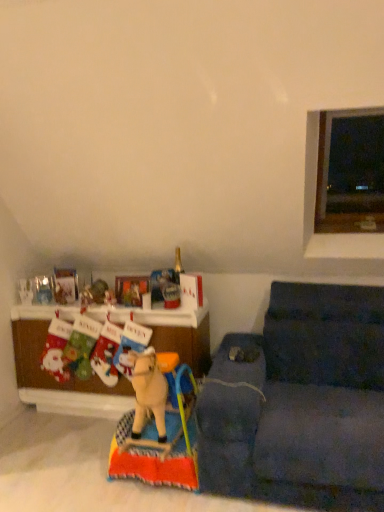
Question: From the image's perspective, is wooden horse at center, the first toy in the right-to-left sequence, under metallic reflective picture frame at center?

Choices:
 (A) yes
 (B) no

Answer: (A)

Question: Is wooden horse at center, which is the second toy from top to bottom, surrounding metallic reflective picture frame at center?

Choices:
 (A) yes
 (B) no

Answer: (B)

Question: Is wooden horse at center, positioned as the first toy in front-to-back order, aimed at metallic reflective picture frame at center?

Choices:
 (A) no
 (B) yes

Answer: (A)

Question: Is wooden horse at center, which is counted as the second toy, starting from the back, closer to camera compared to metallic reflective picture frame at center?

Choices:
 (A) yes
 (B) no

Answer: (A)

Question: Is wooden horse at center, positioned as the first toy in front-to-back order, shorter than metallic reflective picture frame at center?

Choices:
 (A) no
 (B) yes

Answer: (A)

Question: Is wooden horse at center, which is the second toy from top to bottom, far away from metallic reflective picture frame at center?

Choices:
 (A) yes
 (B) no

Answer: (B)

Question: Considering the relative positions of metallic reflective picture frame at center and wooden horse at center, which is counted as the second toy, starting from the back, in the image provided, is metallic reflective picture frame at center in front of wooden horse at center, which is counted as the second toy, starting from the back,?

Choices:
 (A) no
 (B) yes

Answer: (A)

Question: Considering the relative sizes of metallic reflective picture frame at center and wooden horse at center, the first toy in the right-to-left sequence, in the image provided, is metallic reflective picture frame at center shorter than wooden horse at center, the first toy in the right-to-left sequence,?

Choices:
 (A) yes
 (B) no

Answer: (A)

Question: Is metallic reflective picture frame at center far away from wooden horse at center, the first toy in the right-to-left sequence?

Choices:
 (A) no
 (B) yes

Answer: (A)

Question: From the image's perspective, is metallic reflective picture frame at center on top of wooden horse at center, which is the 2th toy in left-to-right order?

Choices:
 (A) no
 (B) yes

Answer: (B)

Question: Is wooden horse at center, positioned as the first toy in front-to-back order, surrounded by metallic reflective picture frame at center?

Choices:
 (A) yes
 (B) no

Answer: (B)

Question: Considering the relative sizes of metallic reflective picture frame at center and wooden horse at center, which is the second toy from top to bottom, in the image provided, is metallic reflective picture frame at center taller than wooden horse at center, which is the second toy from top to bottom,?

Choices:
 (A) no
 (B) yes

Answer: (A)

Question: Is transparent glass window at upper right positioned with its back to dark blue fabric couch at lower right?

Choices:
 (A) yes
 (B) no

Answer: (B)